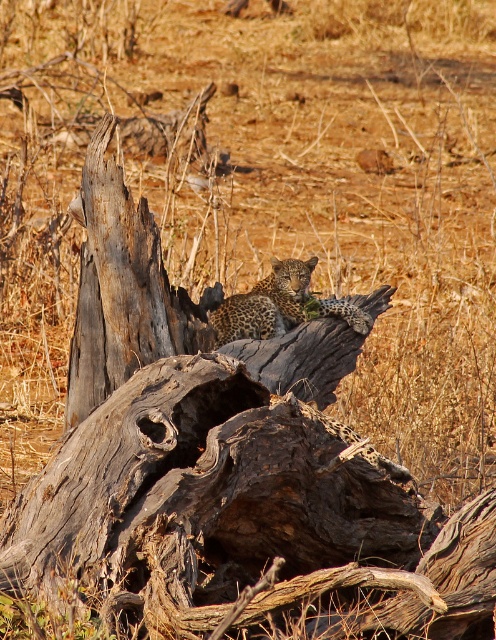
Question: Is brown rough tree trunk at center to the left of spotted fur leopard at center from the viewer's perspective?

Choices:
 (A) no
 (B) yes

Answer: (B)

Question: Is brown rough tree trunk at center to the left of spotted fur leopard at center from the viewer's perspective?

Choices:
 (A) yes
 (B) no

Answer: (A)

Question: Is brown rough tree trunk at center smaller than spotted fur leopard at center?

Choices:
 (A) yes
 (B) no

Answer: (B)